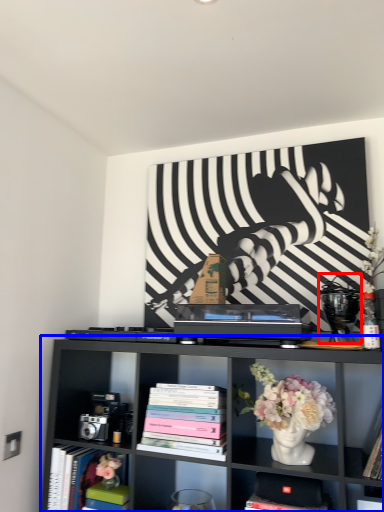
Question: Which object appears closest to the camera in this image, toy (highlighted by a red box) or shelf (highlighted by a blue box)?

Choices:
 (A) toy
 (B) shelf

Answer: (B)